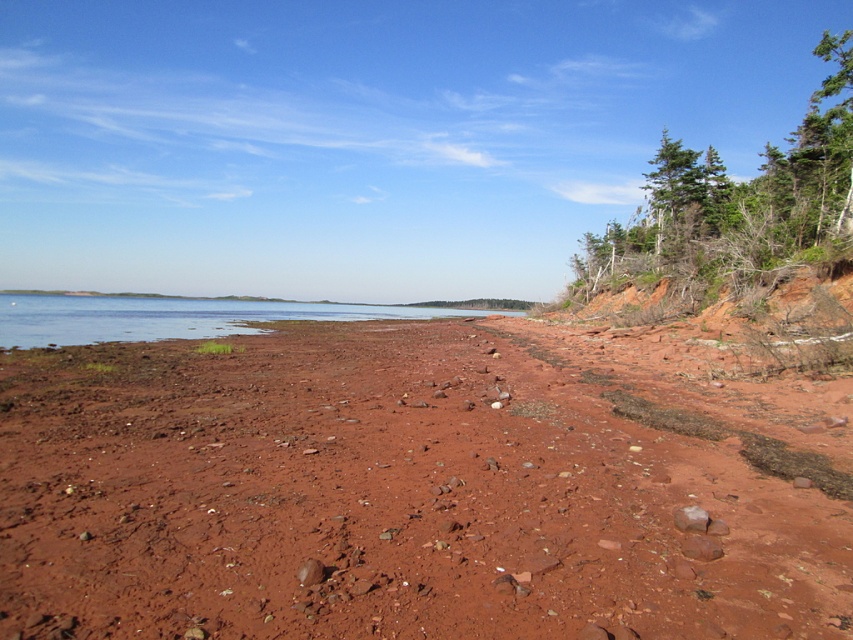
Question: Which of the following is the closest to the observer?

Choices:
 (A) (163, 336)
 (B) (593, 417)

Answer: (B)

Question: Can you confirm if reddish-brown gravel at center is positioned above clear water at center?

Choices:
 (A) yes
 (B) no

Answer: (B)

Question: Is reddish-brown gravel at center positioned behind clear water at center?

Choices:
 (A) no
 (B) yes

Answer: (A)

Question: Which of the following is the closest to the observer?

Choices:
 (A) (90, 461)
 (B) (653, 228)

Answer: (A)

Question: Which object is positioned closest to the reddish-brown gravel at center?

Choices:
 (A) clear water at center
 (B) green leafy trees at upper right

Answer: (A)

Question: Where is green leafy trees at upper right located in relation to clear water at center in the image?

Choices:
 (A) below
 (B) above

Answer: (B)